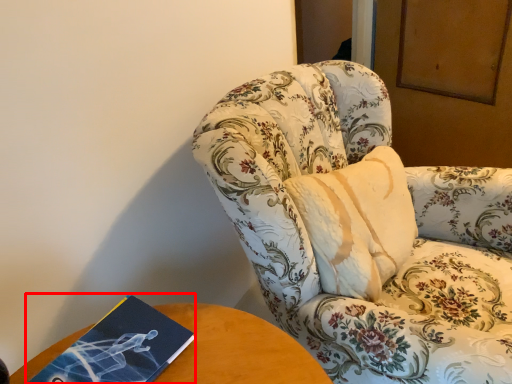
Question: Where is paperback book (annotated by the red box) located in relation to chair in the image?

Choices:
 (A) right
 (B) left

Answer: (B)